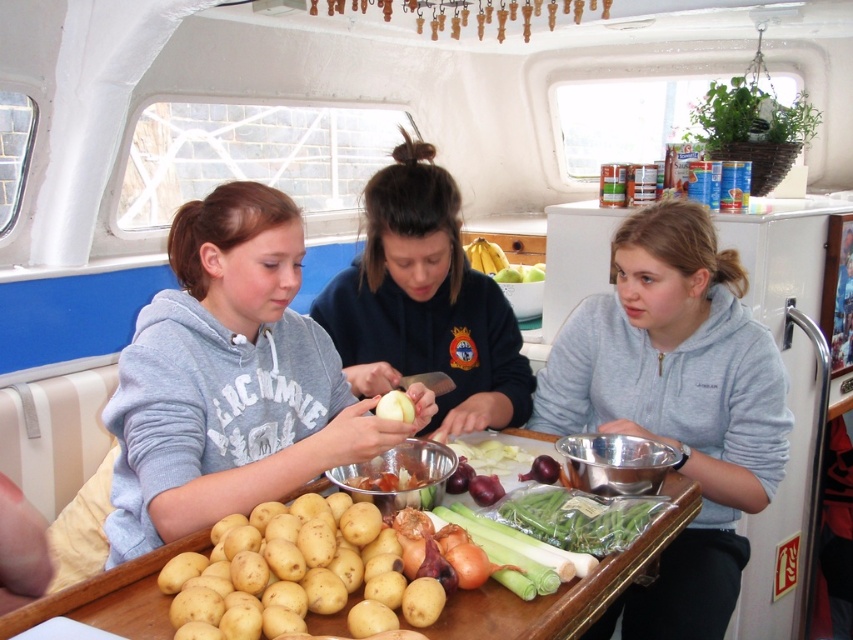
Question: Considering the real-world distances, which object is farthest from the gray fleece hoodie at center?

Choices:
 (A) yellow matte onion at center
 (B) smooth wooden table at center

Answer: (A)

Question: Is matte gray hoodie at center further to the viewer compared to dark blue sweatshirt at center?

Choices:
 (A) yes
 (B) no

Answer: (B)

Question: Which object is the closest to the yellow matte bananas at center?

Choices:
 (A) smooth wooden table at center
 (B) green plastic bag of green beans at center

Answer: (B)

Question: Which point is farther to the camera?

Choices:
 (A) (403, 401)
 (B) (624, 260)

Answer: (B)

Question: Can you confirm if yellow matte potatoes at center is positioned below yellow matte bananas at center?

Choices:
 (A) no
 (B) yes

Answer: (B)

Question: In this image, where is gray fleece hoodie at center located relative to green plastic bag of green beans at center?

Choices:
 (A) below
 (B) above

Answer: (B)